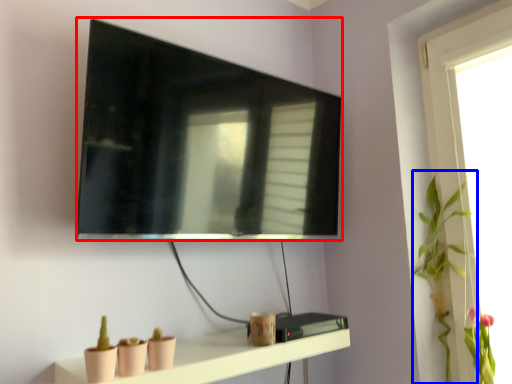
Question: Which object appears farthest to the camera in this image, television (highlighted by a red box) or plant (highlighted by a blue box)?

Choices:
 (A) television
 (B) plant

Answer: (B)